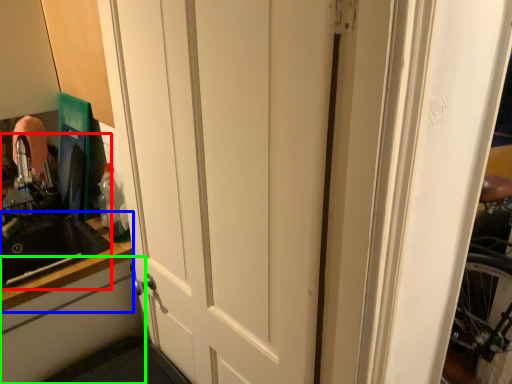
Question: Estimate the real-world distances between objects in this image. Which object is closer to sink (highlighted by a red box), counter top (highlighted by a blue box) or cabinetry (highlighted by a green box)?

Choices:
 (A) counter top
 (B) cabinetry

Answer: (A)